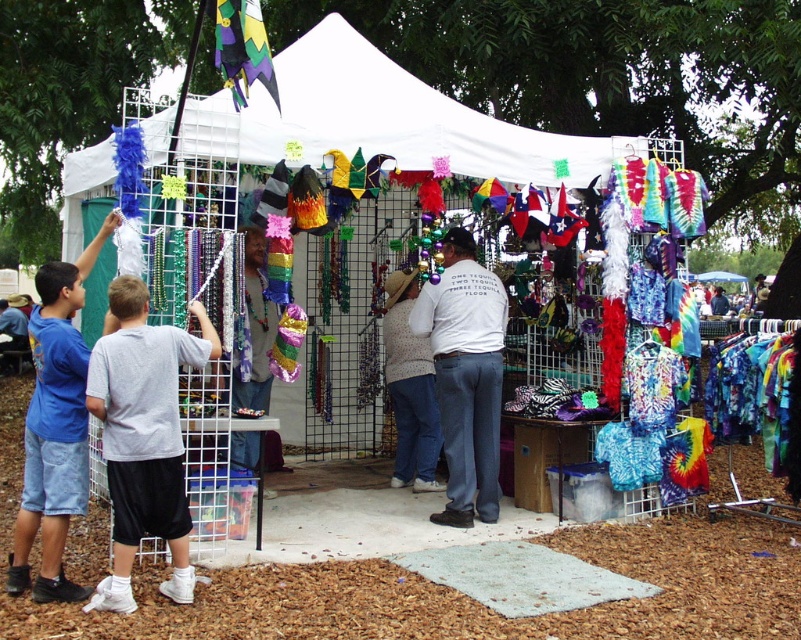
Question: Considering the real-world distances, which object is closest to the white cotton shirt at center?

Choices:
 (A) shiny metallic beads at center
 (B) blue denim shorts at lower left

Answer: (A)

Question: Does blue denim shorts at lower left have a greater width compared to shiny metallic beads at center?

Choices:
 (A) yes
 (B) no

Answer: (A)

Question: Is gray cotton shirt at left above shiny metallic beads at center?

Choices:
 (A) no
 (B) yes

Answer: (A)

Question: Which point is closer to the camera taking this photo?

Choices:
 (A) (38, 406)
 (B) (248, 236)
 (C) (445, 301)
 (D) (164, 337)

Answer: (D)

Question: Is blue denim shorts at lower left to the right of shiny metallic beads at center from the viewer's perspective?

Choices:
 (A) yes
 (B) no

Answer: (B)

Question: Which point appears closest to the camera in this image?

Choices:
 (A) (264, 392)
 (B) (549, 161)

Answer: (B)